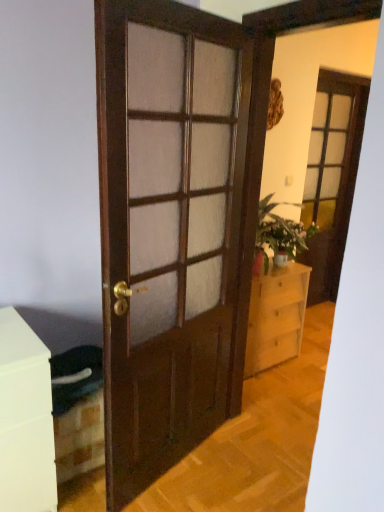
Where is `free location in front of light wood chest of drawers at center`? free location in front of light wood chest of drawers at center is located at coordinates (287, 397).